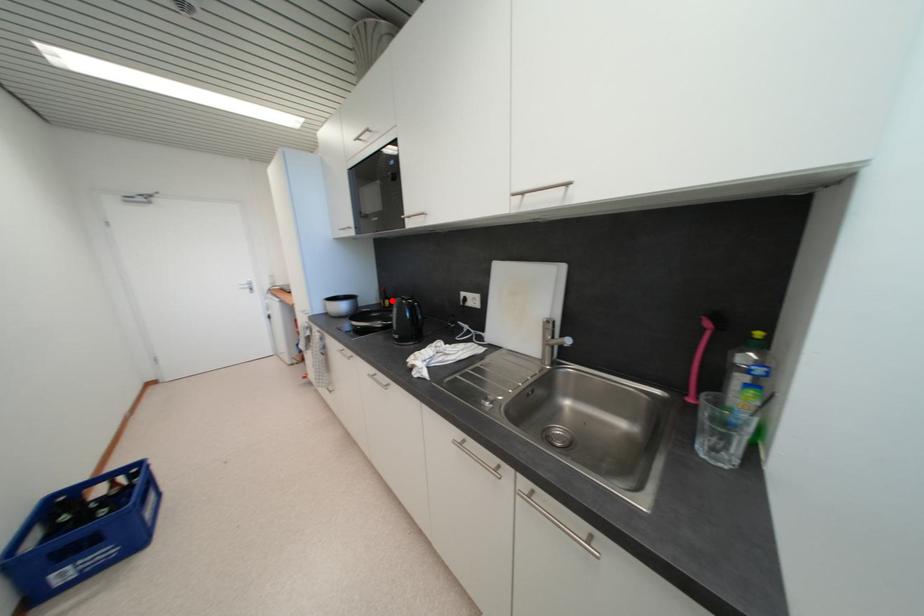
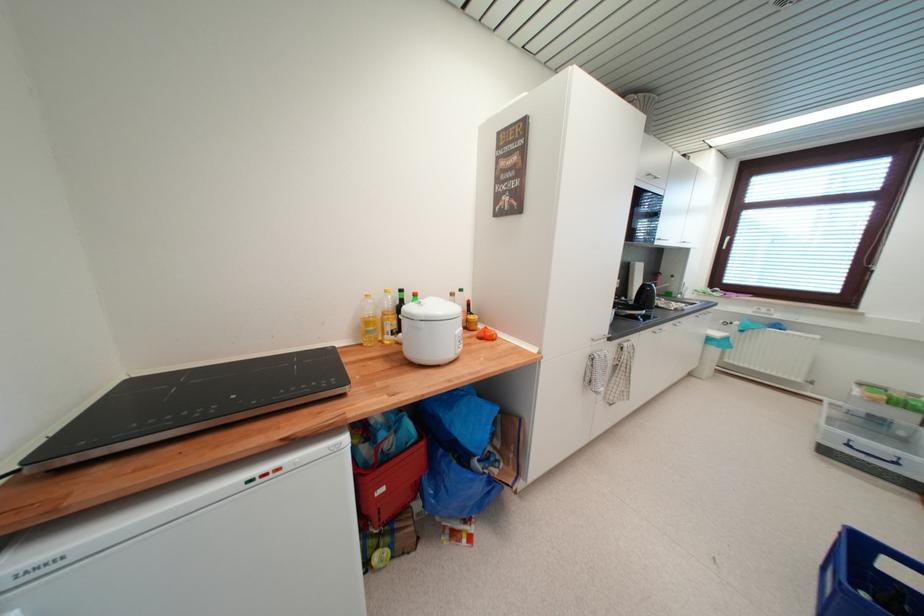
Question: I am providing you with two images of the same scene from different viewpoints. A red point is marked on the first image. Can you still see the location of the red point in image 2?

Choices:
 (A) Yes
 (B) No

Answer: (B)